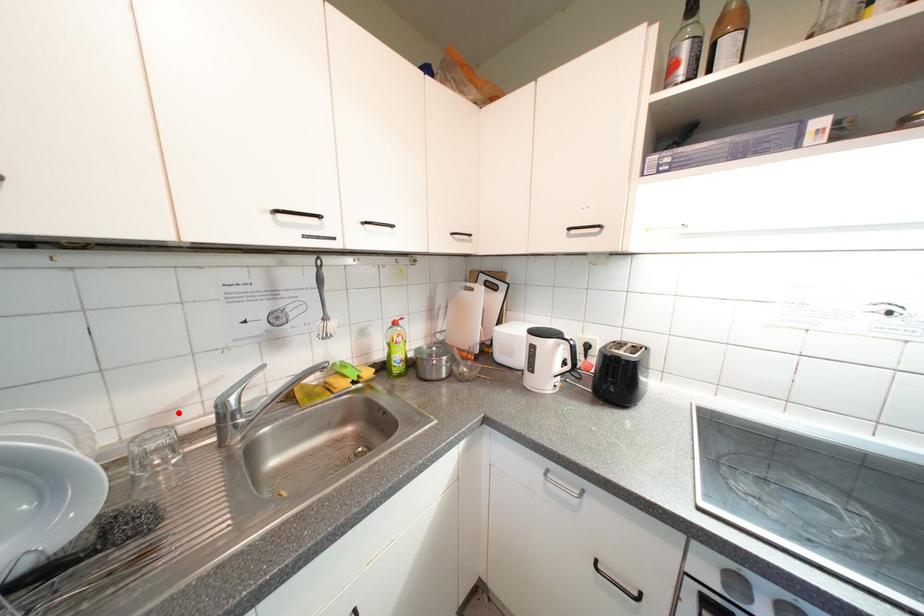
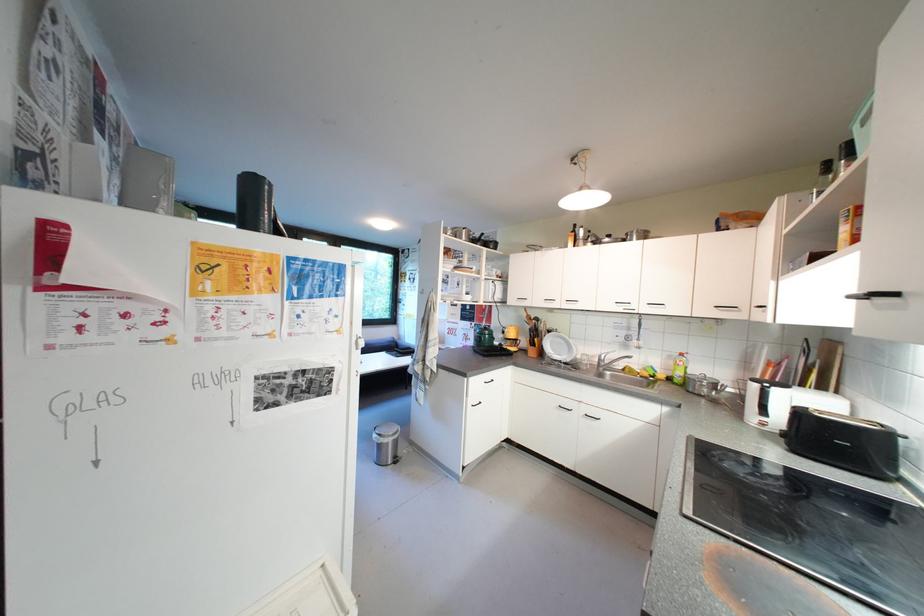
Find the pixel in the second image that matches the highlighted location in the first image.

(602, 359)